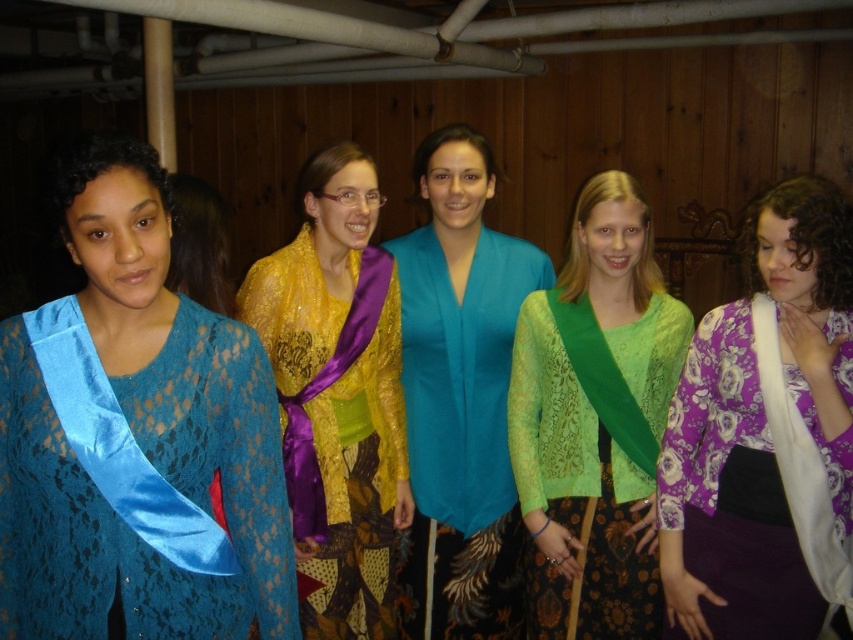
Question: Does blue satin sash at left come in front of green lace sash at center?

Choices:
 (A) no
 (B) yes

Answer: (B)

Question: Which of these objects is positioned farthest from the blue satin sash at left?

Choices:
 (A) green lace sash at center
 (B) shiny purple sash at center

Answer: (A)

Question: Is the position of blue satin sash at left more distant than that of teal satin blouse at center?

Choices:
 (A) no
 (B) yes

Answer: (A)

Question: Which point is closer to the camera?

Choices:
 (A) (619, 474)
 (B) (74, 403)
 (C) (432, 236)
 (D) (312, 317)

Answer: (B)

Question: Estimate the real-world distances between objects in this image. Which object is closer to the blue satin sash at left?

Choices:
 (A) teal satin blouse at center
 (B) purple floral kimono at right
 (C) shiny purple sash at center
 (D) satin blue sash at left

Answer: (D)

Question: Is blue satin sash at left further to the viewer compared to shiny purple sash at center?

Choices:
 (A) no
 (B) yes

Answer: (A)